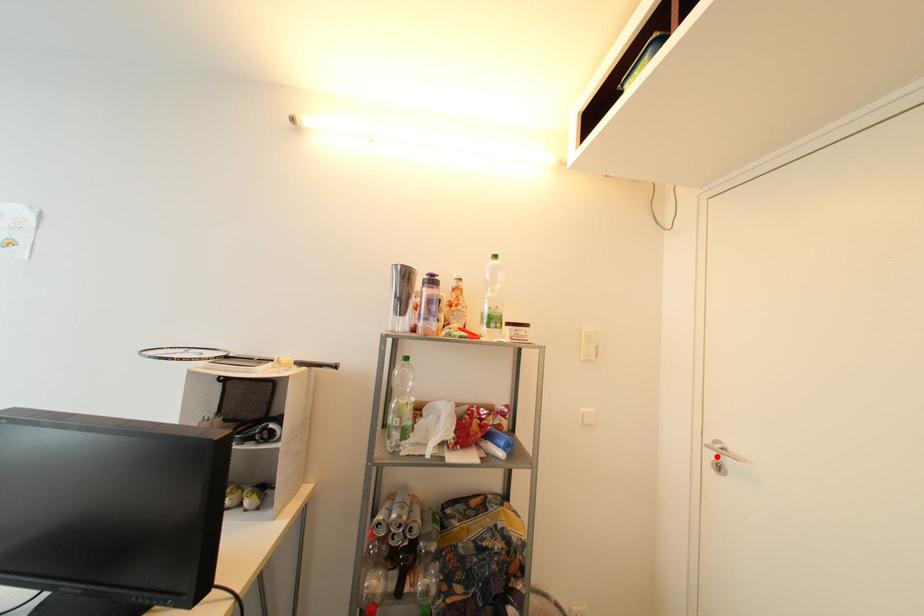
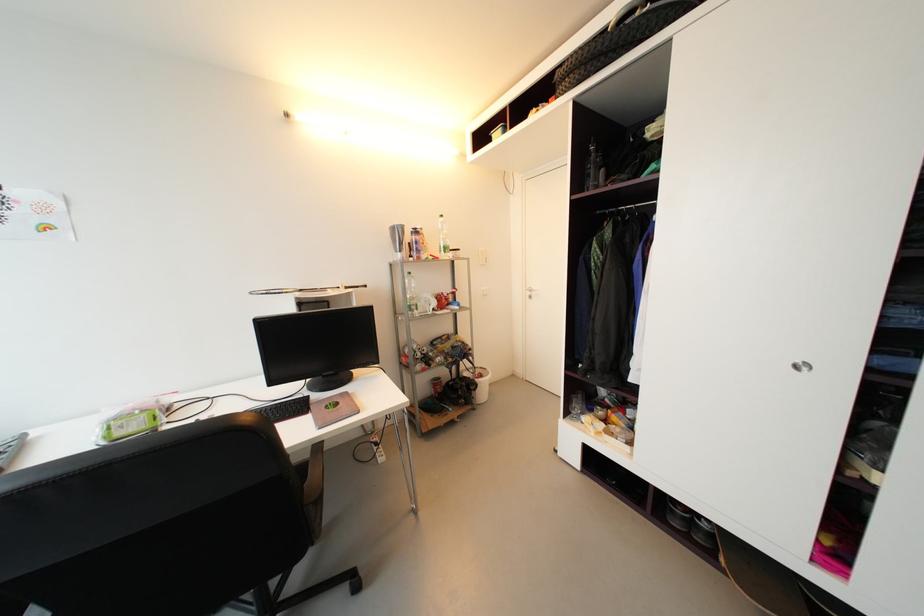
Question: I am providing you with two images of the same scene from different viewpoints. A red point is marked on the first image. At the location where the point appears in image 1, is it still visible in image 2?

Choices:
 (A) Yes
 (B) No

Answer: (A)